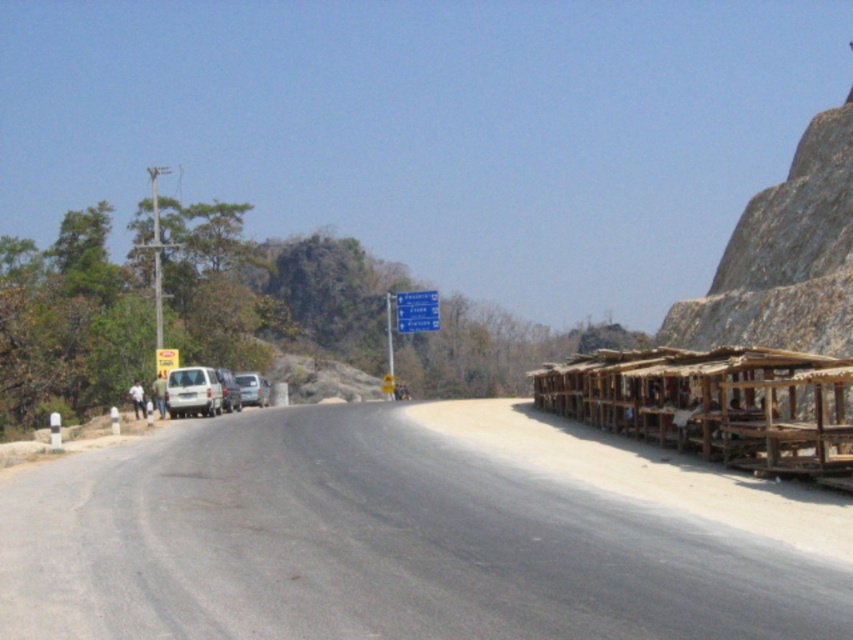
You are driving a delivery truck that is 10 meters long. You need to make a U turn on the road. Can you fit your truck within the space occupied by the smooth asphalt road at center and the white matte van at center?

The smooth asphalt road at center occupies less space than the white matte van at center. Since the truck is 10 meters long, it cannot fit within the space taken by the smooth asphalt road at center, which is smaller than the van. Therefore, the truck cannot make the U turn here.

You are a pedestrian standing at the edge of the road and want to cross to the row of wooden structures on the right. There is a silver metallic car at center and a white matte van at center in your path. Which vehicle is closer to you that you need to be cautious of first?

The silver metallic car at center is closer to you than the white matte van at center, so you should be cautious of the silver metallic car at center first.

You are driving a car and see two points on the road ahead. The first point is at coordinates point [183,416] and the second is at point [242,384]. According to the scene, which point is closer to you?

Point [183,416] is in front of point [242,384], so it is closer to you.